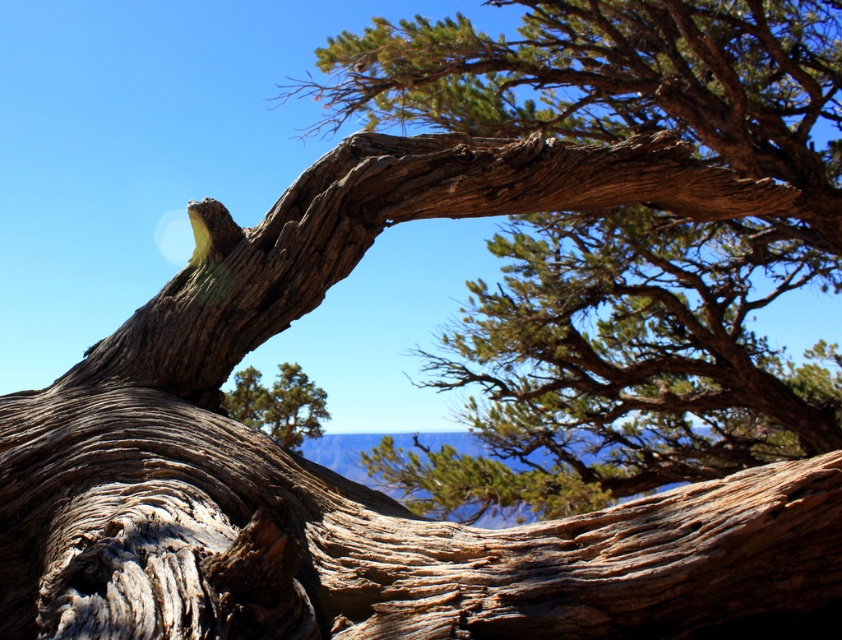
Question: Does rough bark tree at upper center appear under green textured pine tree at center?

Choices:
 (A) yes
 (B) no

Answer: (B)

Question: Is the position of rough bark tree at upper center more distant than that of green textured pine tree at center?

Choices:
 (A) no
 (B) yes

Answer: (A)

Question: Does rough bark tree at upper center appear under green textured pine tree at center?

Choices:
 (A) yes
 (B) no

Answer: (B)

Question: Which object appears farthest from the camera in this image?

Choices:
 (A) rough bark tree at upper center
 (B) green textured pine tree at center

Answer: (B)